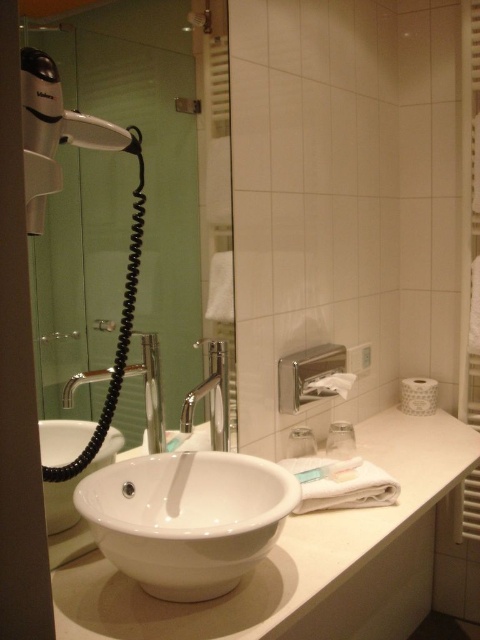
Does white glossy sink at center appear over white matte soap at center?

No, white glossy sink at center is not above white matte soap at center.

Is white glossy sink at center positioned at the back of white matte soap at center?

No.

Is point (179, 576) positioned in front of point (298, 477)?

That is True.

Where is `white glossy sink at center`? This screenshot has width=480, height=640. white glossy sink at center is located at coordinates (187, 518).

In the scene shown: Is white matte soap at center to the left of clear plastic soap dispenser at center from the viewer's perspective?

In fact, white matte soap at center is to the right of clear plastic soap dispenser at center.

Which is behind, point (327, 472) or point (296, 456)?

Positioned behind is point (296, 456).

The width and height of the screenshot is (480, 640). Identify the location of white matte soap at center. (328, 470).

Which is behind, point (332, 451) or point (297, 456)?

Positioned behind is point (332, 451).

Does clear plastic container at center lie in front of clear plastic soap dispenser at center?

No, clear plastic container at center is further to the viewer.

The height and width of the screenshot is (640, 480). Describe the element at coordinates (340, 440) in the screenshot. I see `clear plastic container at center` at that location.

In order to click on clear plastic container at center in this screenshot , I will do `click(340, 440)`.